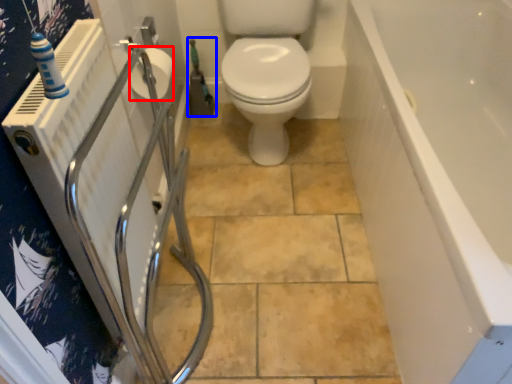
Question: Which point is closer to the camera, toilet paper (highlighted by a red box) or garden hose (highlighted by a blue box)?

Choices:
 (A) toilet paper
 (B) garden hose

Answer: (A)